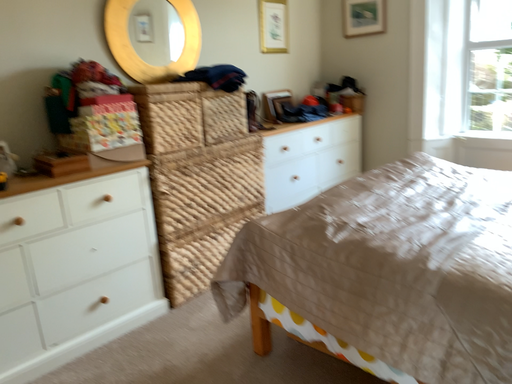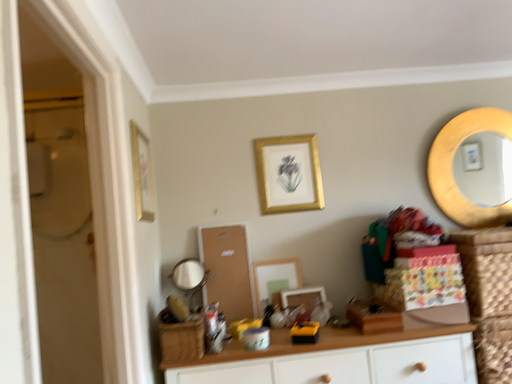
Question: Which way did the camera rotate in the video?

Choices:
 (A) rotated left
 (B) rotated right

Answer: (A)